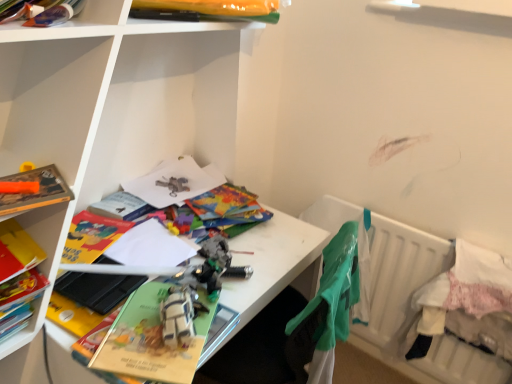
Where is `empty space that is ontop of matte green paperback book at center, placed as the 2th paperback book when sorted from top to bottom (from a real-world perspective)`? This screenshot has height=384, width=512. empty space that is ontop of matte green paperback book at center, placed as the 2th paperback book when sorted from top to bottom (from a real-world perspective) is located at coordinates tap(156, 327).